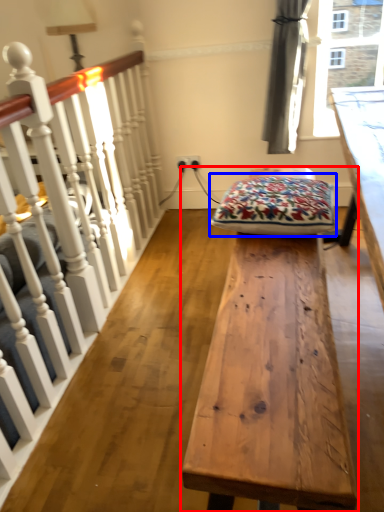
Question: Which object appears farthest to the camera in this image, table (highlighted by a red box) or blanket (highlighted by a blue box)?

Choices:
 (A) table
 (B) blanket

Answer: (B)